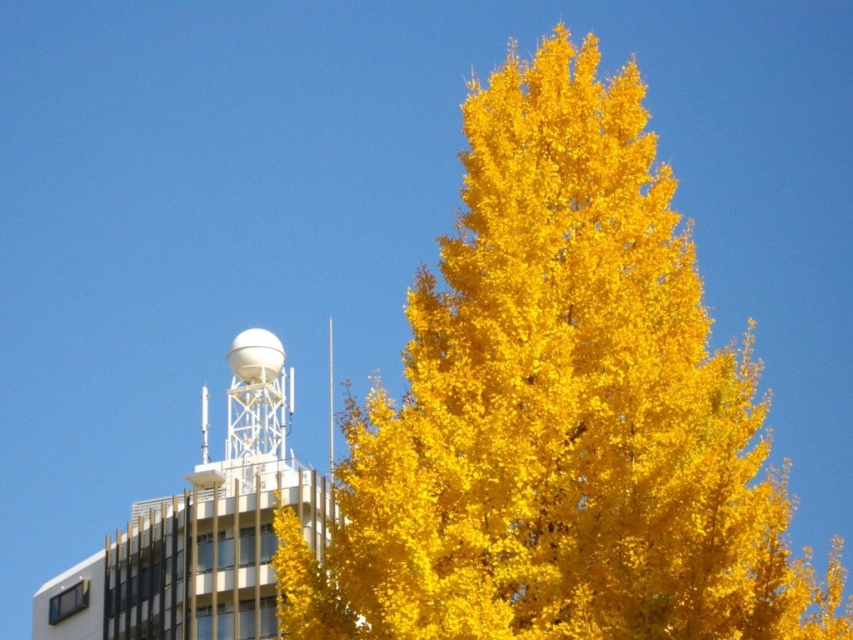
Can you confirm if golden yellow foliage at center is bigger than white matte water tower at upper left?

Yes, golden yellow foliage at center is bigger than white matte water tower at upper left.

Between point (738, 596) and point (281, 371), which one is positioned behind?

Point (281, 371)

Locate an element on the screen. This screenshot has height=640, width=853. golden yellow foliage at center is located at coordinates (560, 412).

Who is positioned more to the left, white metallic tower at upper left or white matte water tower at upper left?

white metallic tower at upper left

Describe the element at coordinates (202, 529) in the screenshot. I see `white metallic tower at upper left` at that location.

Does point (144, 522) come behind point (270, 333)?

No, (144, 522) is closer to viewer.

At what (x,y) coordinates should I click in order to perform the action: click on white metallic tower at upper left. Please return your answer as a coordinate pair (x, y). Looking at the image, I should click on (202, 529).

Does golden yellow foliage at center have a larger size compared to white metallic tower at upper left?

Yes, golden yellow foliage at center is bigger than white metallic tower at upper left.

At what (x,y) coordinates should I click in order to perform the action: click on golden yellow foliage at center. Please return your answer as a coordinate pair (x, y). Looking at the image, I should click on (560, 412).